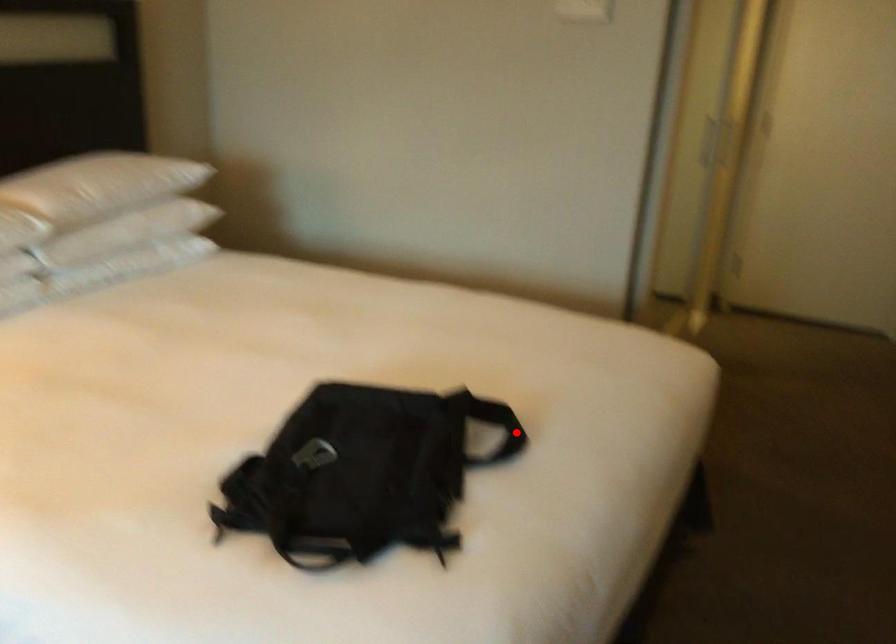
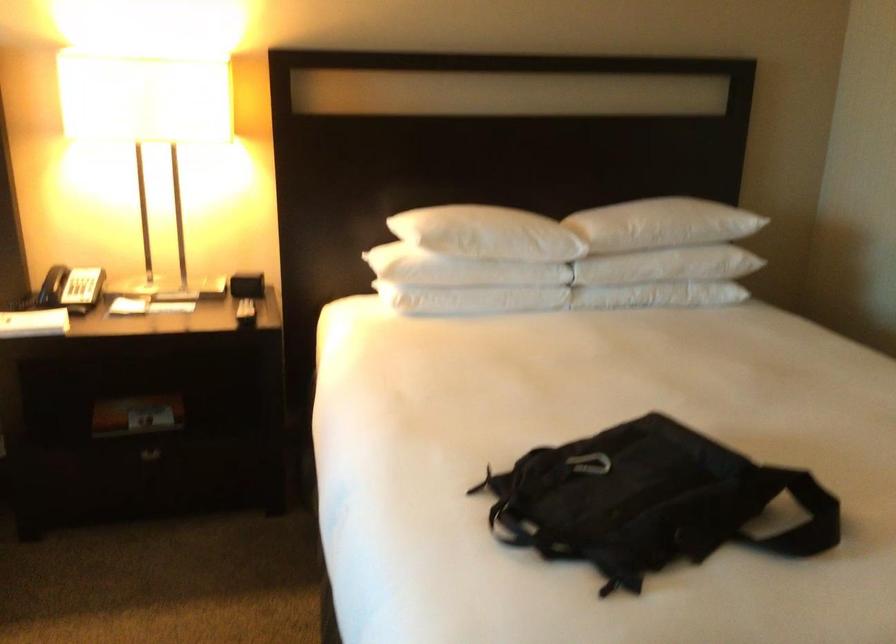
The point at the highlighted location is marked in the first image. Where is the corresponding point in the second image?

(811, 527)